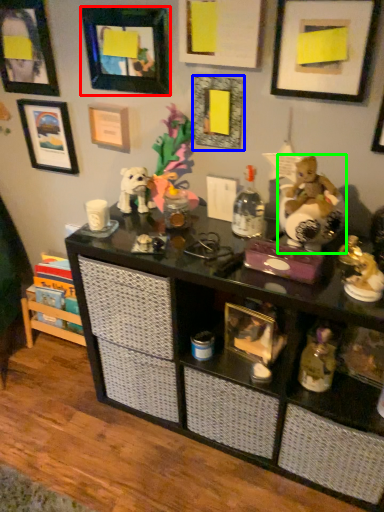
Question: Estimate the real-world distances between objects in this image. Which object is farther from picture frame (highlighted by a red box), picture frame (highlighted by a blue box) or toy (highlighted by a green box)?

Choices:
 (A) picture frame
 (B) toy

Answer: (B)